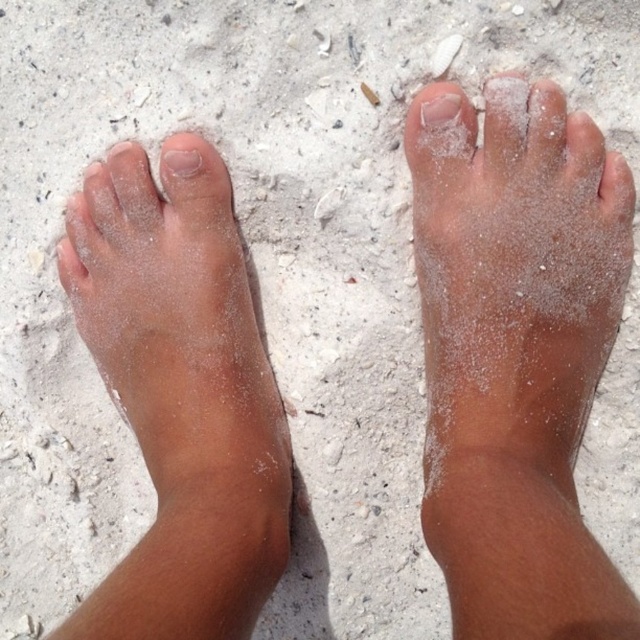
Question: Which point is farther from the camera taking this photo?

Choices:
 (A) (538, 166)
 (B) (195, 172)

Answer: (B)

Question: Which point is closer to the camera?

Choices:
 (A) smooth skin toe at center
 (B) sandy skin foot at left

Answer: (B)

Question: Is smooth skin toe at center behind matte skin toe at center?

Choices:
 (A) no
 (B) yes

Answer: (A)

Question: Does sandy skin foot at left have a greater width compared to matte skin toe at center?

Choices:
 (A) no
 (B) yes

Answer: (B)

Question: Observing the image, what is the correct spatial positioning of sandy skin foot at left in reference to matte skin toe at center?

Choices:
 (A) right
 (B) left

Answer: (A)

Question: Among these objects, which one is nearest to the camera?

Choices:
 (A) smooth skin toe at center
 (B) sandy skin foot at left
 (C) matte skin toe at center
 (D) sandy skin foot at center

Answer: (D)